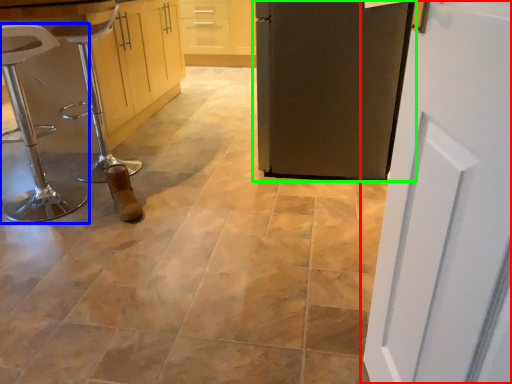
Question: Based on their relative distances, which object is nearer to door (highlighted by a red box)? Choose from furniture (highlighted by a blue box) and door (highlighted by a green box).

Choices:
 (A) furniture
 (B) door

Answer: (B)